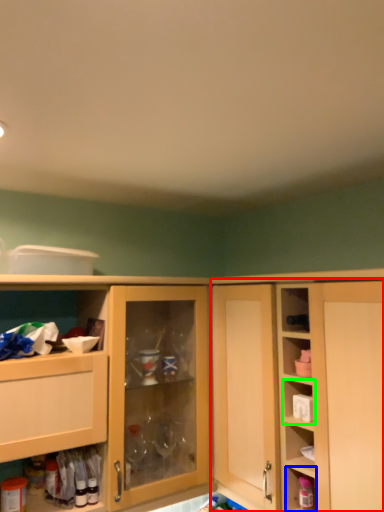
Question: Estimate the real-world distances between objects in this image. Which object is closer to cabinetry (highlighted by a red box), cabinet (highlighted by a blue box) or shelf (highlighted by a green box)?

Choices:
 (A) cabinet
 (B) shelf

Answer: (B)